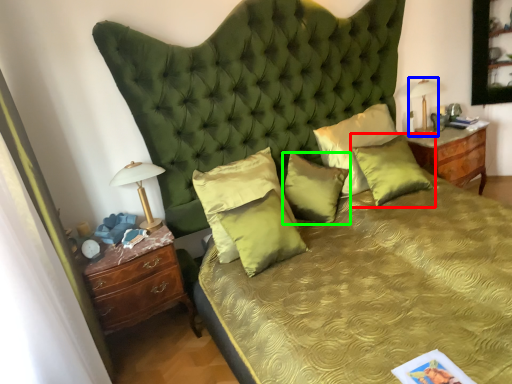
Question: Estimate the real-world distances between objects in this image. Which object is farther from pillow (highlighted by a red box), bedside lamp (highlighted by a blue box) or pillow (highlighted by a green box)?

Choices:
 (A) bedside lamp
 (B) pillow

Answer: (A)